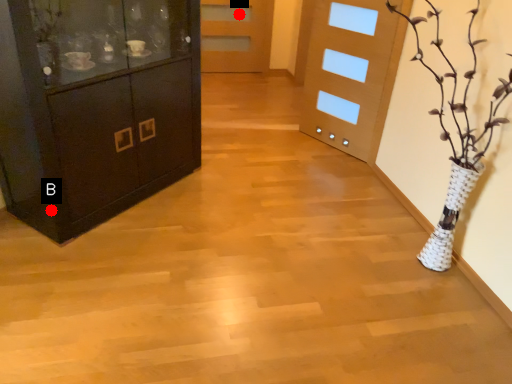
Question: Two points are circled on the image, labeled by A and B beside each circle. Which point is closer to the camera?

Choices:
 (A) A is closer
 (B) B is closer

Answer: (B)